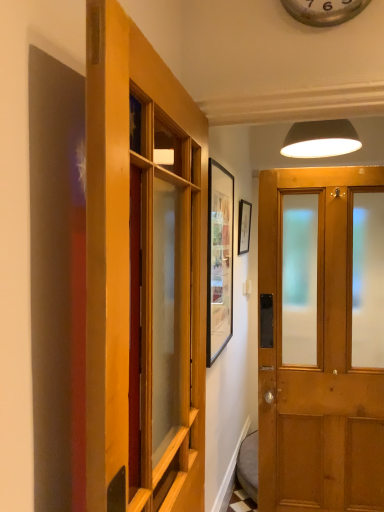
Question: Based on their positions, is matte black lampshade at upper center located to the left or right of matte black picture frame at upper center?

Choices:
 (A) left
 (B) right

Answer: (B)

Question: Is matte black lampshade at upper center in front of or behind matte black picture frame at upper center in the image?

Choices:
 (A) behind
 (B) front

Answer: (B)

Question: Estimate the real-world distances between objects in this image. Which object is closer to the matte black picture frame at upper center?

Choices:
 (A) metallic silver clock at upper center
 (B) wooden door at center, marked as the second door in a right-to-left arrangement
 (C) matte black lampshade at upper center
 (D) wooden door at center, marked as the 2th door in a left-to-right arrangement

Answer: (C)

Question: Which of these objects is positioned farthest from the metallic silver clock at upper center?

Choices:
 (A) matte black lampshade at upper center
 (B) wooden door at center, arranged as the first door when viewed from the right
 (C) matte black picture frame at upper center
 (D) wooden door at center, arranged as the first door when viewed from the left

Answer: (C)